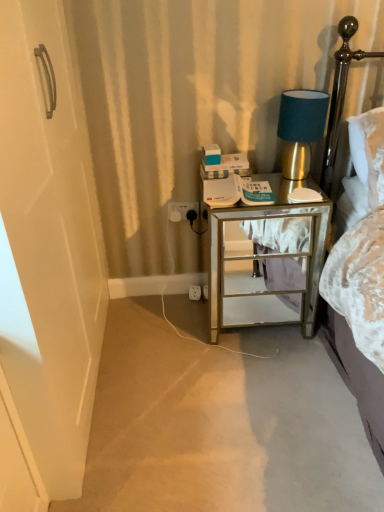
Question: Should I look upward or downward to see metallic gold headboard at upper right?

Choices:
 (A) down
 (B) up

Answer: (B)

Question: Is white plastic electric outlet at lower center, positioned as the 1th electric outlet in front-to-back order, to the left of mirrored glass nightstand at right from the viewer's perspective?

Choices:
 (A) yes
 (B) no

Answer: (A)

Question: Is mirrored glass nightstand at right surrounded by white plastic electric outlet at lower center, positioned as the 1th electric outlet in front-to-back order?

Choices:
 (A) yes
 (B) no

Answer: (B)

Question: Does white plastic electric outlet at lower center, the 1th electric outlet when ordered from top to bottom, turn towards mirrored glass nightstand at right?

Choices:
 (A) yes
 (B) no

Answer: (B)

Question: Can you confirm if white plastic electric outlet at lower center, the second electric outlet viewed from the back, is bigger than mirrored glass nightstand at right?

Choices:
 (A) no
 (B) yes

Answer: (A)

Question: Is white plastic electric outlet at lower center, positioned as the 1th electric outlet in front-to-back order, completely or partially outside of mirrored glass nightstand at right?

Choices:
 (A) yes
 (B) no

Answer: (A)

Question: Considering the relative positions of white plastic electric outlet at lower center, positioned as the 1th electric outlet in front-to-back order, and mirrored glass nightstand at right in the image provided, is white plastic electric outlet at lower center, positioned as the 1th electric outlet in front-to-back order, to the right of mirrored glass nightstand at right from the viewer's perspective?

Choices:
 (A) yes
 (B) no

Answer: (B)

Question: Is white plastic electric outlet at lower center, marked as the 2th electric outlet in a top-to-bottom arrangement, at the left side of mirrored glass nightstand at right?

Choices:
 (A) no
 (B) yes

Answer: (B)

Question: Considering the relative sizes of white plastic electric outlet at lower center, which is the 1th electric outlet in back-to-front order, and mirrored glass nightstand at right in the image provided, is white plastic electric outlet at lower center, which is the 1th electric outlet in back-to-front order, smaller than mirrored glass nightstand at right?

Choices:
 (A) no
 (B) yes

Answer: (B)

Question: From a real-world perspective, is white plastic electric outlet at lower center, marked as the 2th electric outlet in a top-to-bottom arrangement, below mirrored glass nightstand at right?

Choices:
 (A) yes
 (B) no

Answer: (A)

Question: Is white plastic electric outlet at lower center, which is counted as the 1th electric outlet, starting from the bottom, not close to mirrored glass nightstand at right?

Choices:
 (A) yes
 (B) no

Answer: (B)

Question: From the image's perspective, is white plastic electric outlet at lower center, which is counted as the 1th electric outlet, starting from the bottom, located beneath mirrored glass nightstand at right?

Choices:
 (A) yes
 (B) no

Answer: (A)

Question: Is white plastic electric outlet at lower center, arranged as the 2th electric outlet when viewed from the front, positioned beyond the bounds of mirrored glass nightstand at right?

Choices:
 (A) yes
 (B) no

Answer: (A)

Question: Does metallic gold headboard at upper right contain white plastic electric outlet at lower center, marked as the 2th electric outlet in a top-to-bottom arrangement?

Choices:
 (A) no
 (B) yes

Answer: (A)